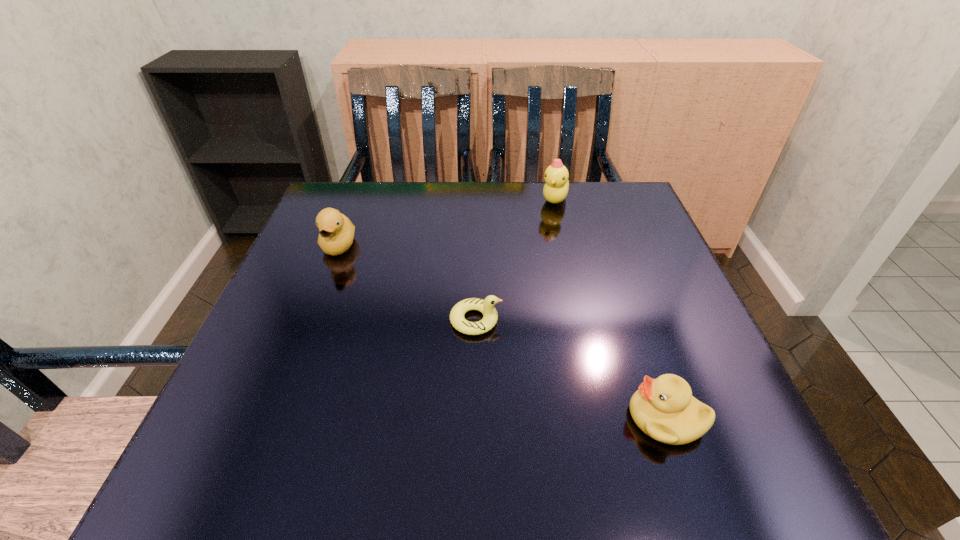
Where is `vacant region at the left edge of the desktop`? This screenshot has height=540, width=960. vacant region at the left edge of the desktop is located at coordinates (262, 395).

The width and height of the screenshot is (960, 540). I want to click on free space at the right edge, so click(661, 279).

The image size is (960, 540). I want to click on free region at the far left corner, so click(x=348, y=189).

At what (x,y) coordinates should I click in order to perform the action: click on free space at the near left corner. Please return your answer as a coordinate pair (x, y). Looking at the image, I should click on (273, 434).

In order to click on vacant space at the near right corner of the desktop in this screenshot , I will do `click(778, 491)`.

This screenshot has height=540, width=960. I want to click on vacant space in between the farthest object and the second shortest duckling, so click(611, 308).

The height and width of the screenshot is (540, 960). What are the coordinates of `vacant space in between the farthest object and the rightmost object` in the screenshot? It's located at (611, 308).

The height and width of the screenshot is (540, 960). I want to click on vacant space that is in between the rightmost duckling and the second object from left to right, so click(571, 369).

Where is `free space that is in between the second shortest duckling and the farthest duckling`? The image size is (960, 540). free space that is in between the second shortest duckling and the farthest duckling is located at coordinates (611, 308).

What are the coordinates of `vacant area between the farthest object and the second shortest duckling` in the screenshot? It's located at click(611, 308).